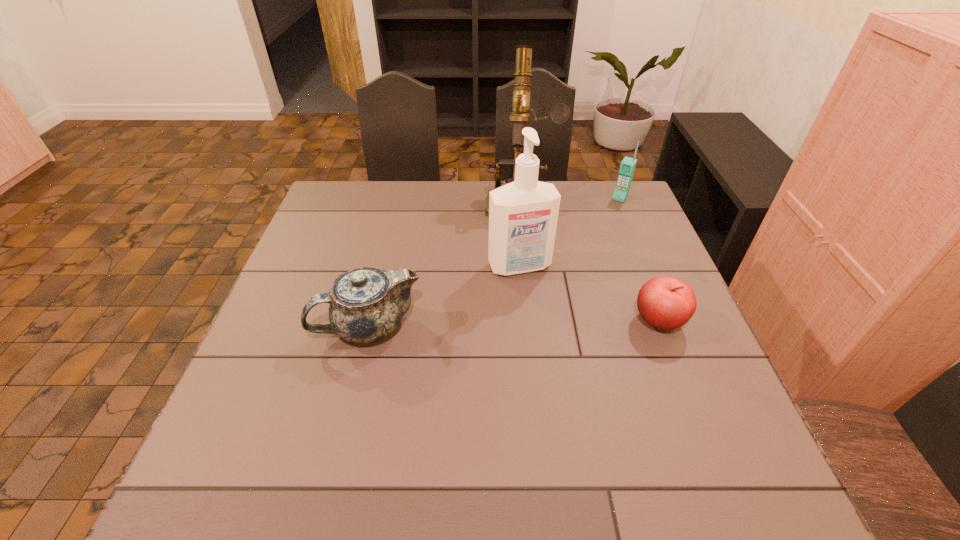
I want to click on the second shortest object, so click(367, 304).

I want to click on chinaware, so click(x=367, y=304).

This screenshot has width=960, height=540. I want to click on the shortest object, so click(x=666, y=303).

The height and width of the screenshot is (540, 960). Find the location of `cleansing agent`. cleansing agent is located at coordinates (523, 215).

Identify the location of the third nearest object. (523, 215).

Image resolution: width=960 pixels, height=540 pixels. Find the location of `microscope`. microscope is located at coordinates (560, 113).

Find the location of a particular element. This screenshot has height=540, width=960. cellular telephone is located at coordinates (627, 167).

You are a GUI agent. You are given a task and a screenshot of the screen. Output one action in this format:
    pyautogui.click(x=<x>, y=<y>)
    Task: Click on the vacant space located on the back of the shortest object
    The height and width of the screenshot is (540, 960).
    Given the screenshot: What is the action you would take?
    pyautogui.click(x=616, y=212)

The height and width of the screenshot is (540, 960). What are the coordinates of `free space located 0.350m on the front label of the third nearest object` in the screenshot? It's located at (581, 393).

I want to click on vacant space located 0.320m on the front label of the third nearest object, so click(x=575, y=381).